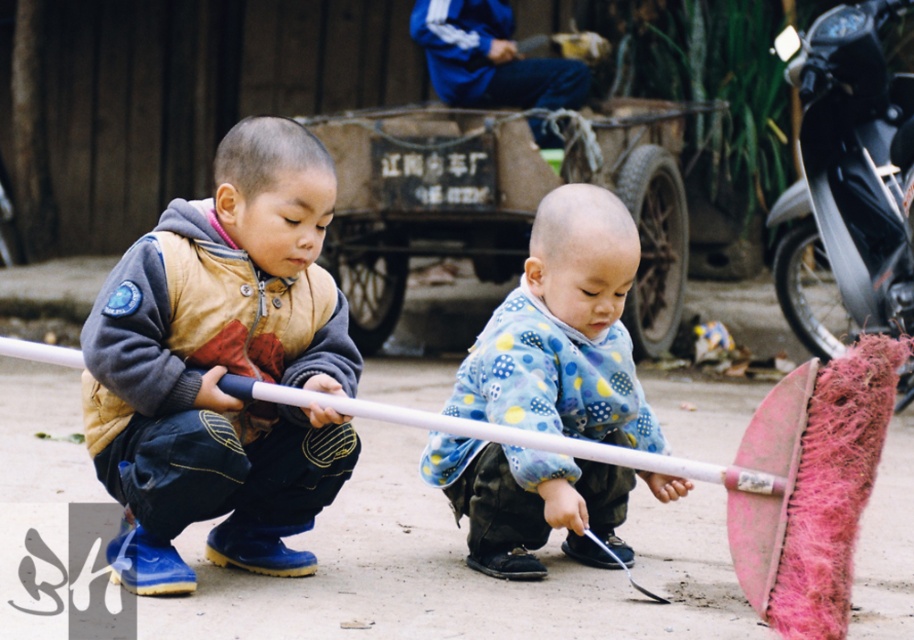
Is brown suede jacket at center smaller than blue fleece jacket at center?

Correct, brown suede jacket at center occupies less space than blue fleece jacket at center.

Who is positioned more to the right, brown suede jacket at center or blue fleece jacket at center?

blue fleece jacket at center is more to the right.

You are a GUI agent. You are given a task and a screenshot of the screen. Output one action in this format:
    pyautogui.click(x=<x>, y=<y>)
    Task: Click on the brown suede jacket at center
    Image resolution: width=914 pixels, height=640 pixels.
    Given the screenshot: What is the action you would take?
    pyautogui.click(x=222, y=365)

Image resolution: width=914 pixels, height=640 pixels. Find the location of `brown suede jacket at center`. brown suede jacket at center is located at coordinates (222, 365).

Is brown suede jacket at center to the left of rusty metal wagon at center from the viewer's perspective?

Correct, you'll find brown suede jacket at center to the left of rusty metal wagon at center.

Can you confirm if brown suede jacket at center is bigger than rusty metal wagon at center?

Actually, brown suede jacket at center might be smaller than rusty metal wagon at center.

Who is more distant from viewer, (x=238, y=182) or (x=663, y=211)?

Positioned behind is point (x=663, y=211).

Find the location of a particular element. This screenshot has width=914, height=640. brown suede jacket at center is located at coordinates (222, 365).

Is rusty metal wagon at center shorter than blue fleece jacket at center?

No, rusty metal wagon at center is not shorter than blue fleece jacket at center.

The image size is (914, 640). What do you see at coordinates (498, 198) in the screenshot?
I see `rusty metal wagon at center` at bounding box center [498, 198].

The width and height of the screenshot is (914, 640). In order to click on rusty metal wagon at center in this screenshot , I will do `click(498, 198)`.